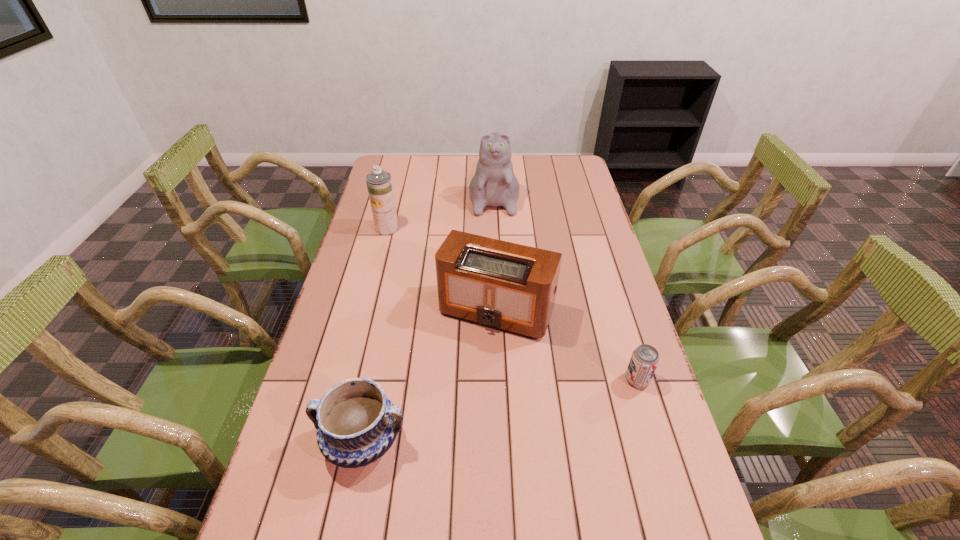
Identify the location of free region at the far left corner of the desktop. (406, 172).

This screenshot has height=540, width=960. I want to click on vacant space at the far right corner of the desktop, so click(563, 171).

The image size is (960, 540). I want to click on empty location between the cat and the beer can, so click(x=565, y=286).

Identify the location of vacant space that's between the fourth farthest object and the cat. (565, 286).

At what (x,y) coordinates should I click in order to perform the action: click on blank region between the third nearest object and the nearest object. Please return your answer as a coordinate pair (x, y). Looking at the image, I should click on (430, 376).

Find the location of `vacant area that lies between the fourth tallest object and the aerosol can`. vacant area that lies between the fourth tallest object and the aerosol can is located at coordinates (375, 335).

I want to click on unoccupied area between the aerosol can and the cat, so click(x=441, y=210).

Where is `free space between the cat and the second farthest object`? The height and width of the screenshot is (540, 960). free space between the cat and the second farthest object is located at coordinates (441, 210).

Where is `the fourth closest object to the third shortest object`? the fourth closest object to the third shortest object is located at coordinates (494, 184).

Image resolution: width=960 pixels, height=540 pixels. What are the coordinates of `object that is the closest to the rightmost object` in the screenshot? It's located at (506, 286).